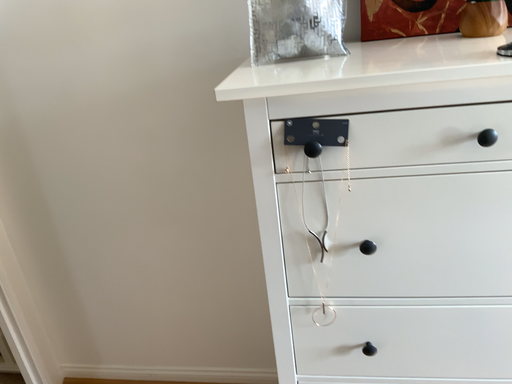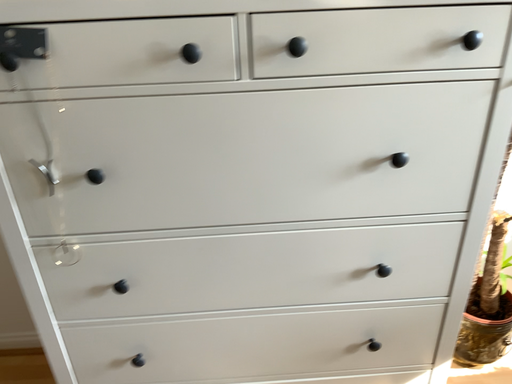
Question: How did the camera likely rotate when shooting the video?

Choices:
 (A) rotated right
 (B) rotated left

Answer: (A)